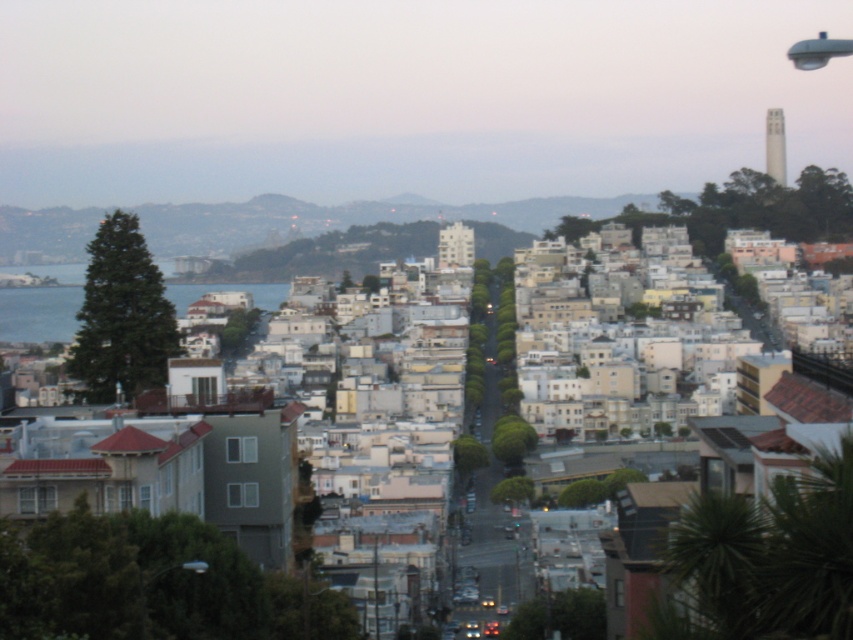
Question: Which object appears farthest from the camera in this image?

Choices:
 (A) blue water at left
 (B) green grassy hillside at center

Answer: (B)

Question: Can you confirm if green grassy hillside at center is wider than blue water at left?

Choices:
 (A) no
 (B) yes

Answer: (B)

Question: Among these points, which one is farthest from the camera?

Choices:
 (A) (258, 289)
 (B) (175, 232)

Answer: (B)

Question: Which point appears closest to the camera in this image?

Choices:
 (A) (1, 250)
 (B) (189, 301)

Answer: (B)

Question: Is green grassy hillside at center behind blue water at left?

Choices:
 (A) yes
 (B) no

Answer: (A)

Question: Is green grassy hillside at center behind blue water at left?

Choices:
 (A) yes
 (B) no

Answer: (A)